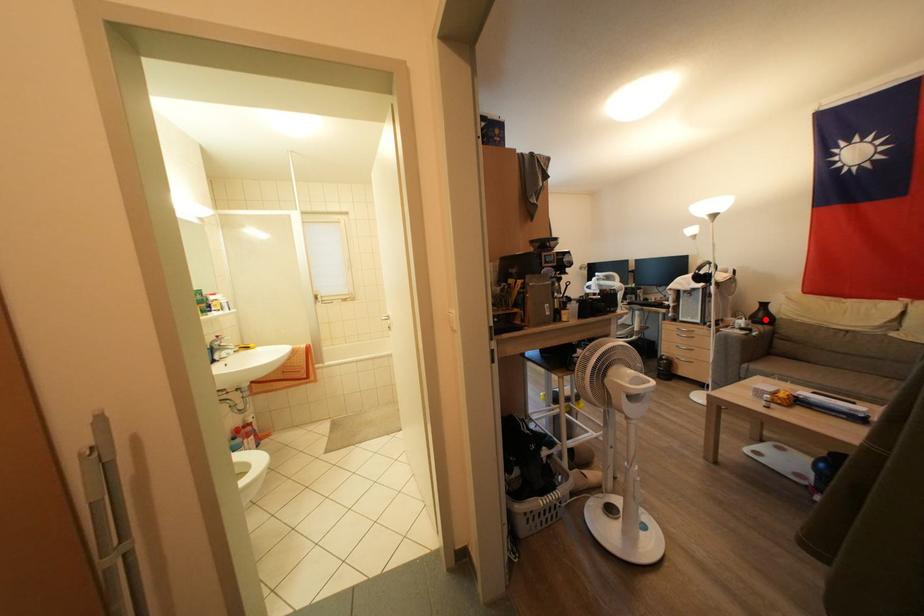
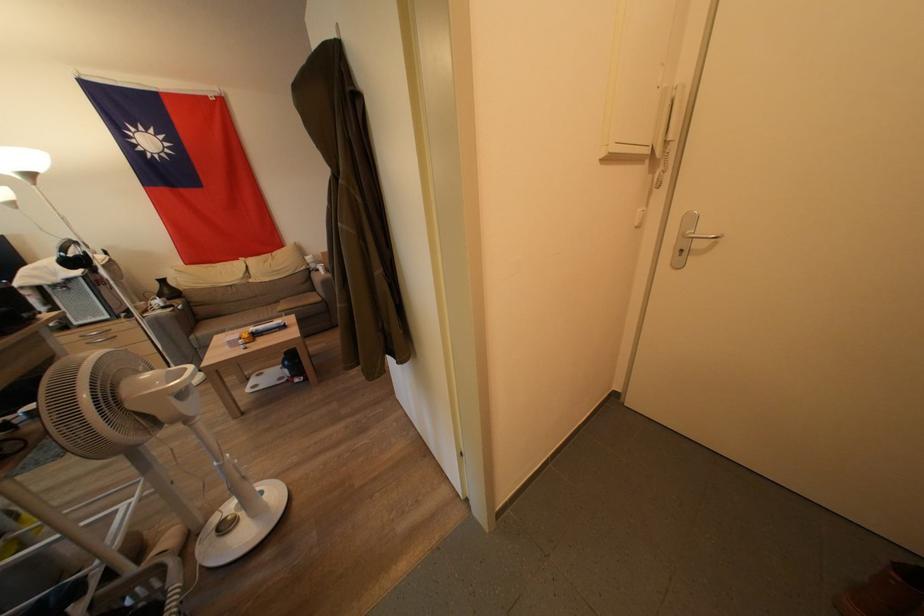
Where in the second image is the point corresponding to the highlighted location from the first image?

(172, 296)